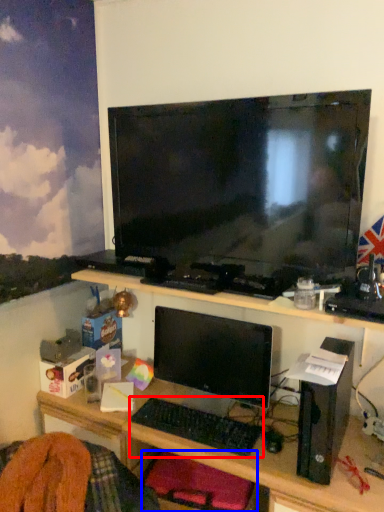
Question: Among these objects, which one is farthest to the camera, computer keyboard (highlighted by a red box) or computer chair (highlighted by a blue box)?

Choices:
 (A) computer keyboard
 (B) computer chair

Answer: (A)